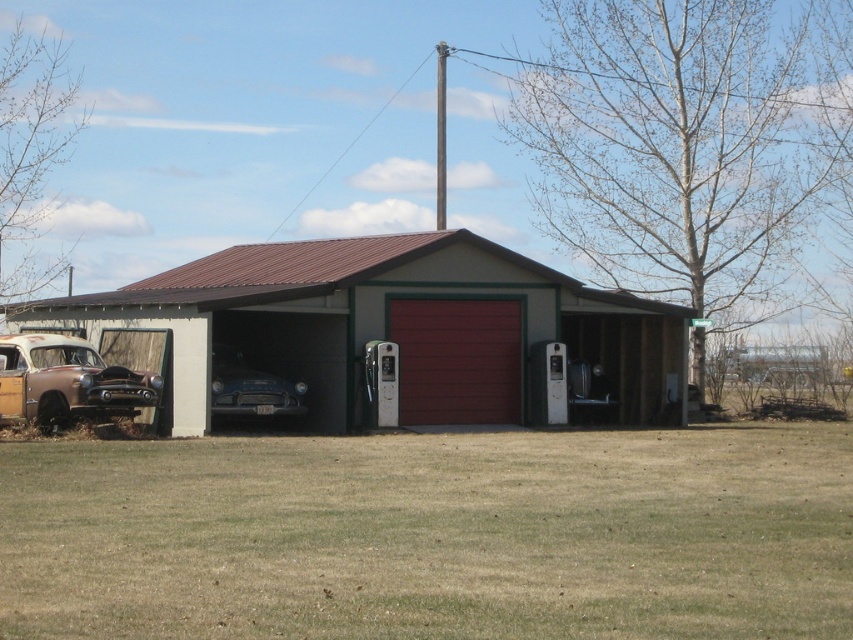
Question: Which object appears farthest from the camera in this image?

Choices:
 (A) rustic wood pickup truck at left
 (B) shiny blue car at center
 (C) matte red garage door at center

Answer: (C)

Question: Considering the real-world distances, which object is farthest from the matte red garage door at center?

Choices:
 (A) shiny blue car at center
 (B) rustic wood pickup truck at left
 (C) metallic red garage door at center

Answer: (B)

Question: Among these points, which one is nearest to the camera?

Choices:
 (A) (149, 396)
 (B) (508, 314)
 (C) (222, 396)

Answer: (A)

Question: Is matte red garage door at center further to camera compared to rustic wood pickup truck at left?

Choices:
 (A) no
 (B) yes

Answer: (B)

Question: Considering the relative positions of rustic wood pickup truck at left and shiny blue car at center in the image provided, where is rustic wood pickup truck at left located with respect to shiny blue car at center?

Choices:
 (A) right
 (B) left

Answer: (B)

Question: Considering the relative positions of rustic wood pickup truck at left and shiny blue car at center in the image provided, where is rustic wood pickup truck at left located with respect to shiny blue car at center?

Choices:
 (A) right
 (B) left

Answer: (B)